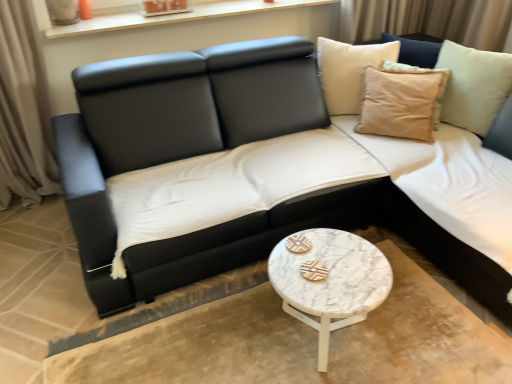
You are a GUI agent. You are given a task and a screenshot of the screen. Output one action in this format:
    pyautogui.click(x=<x>, y=<y>)
    Task: Click on the free point above white marble coffee table at center (from a real-world perspective)
    The image size is (512, 384).
    Given the screenshot: What is the action you would take?
    pyautogui.click(x=329, y=270)